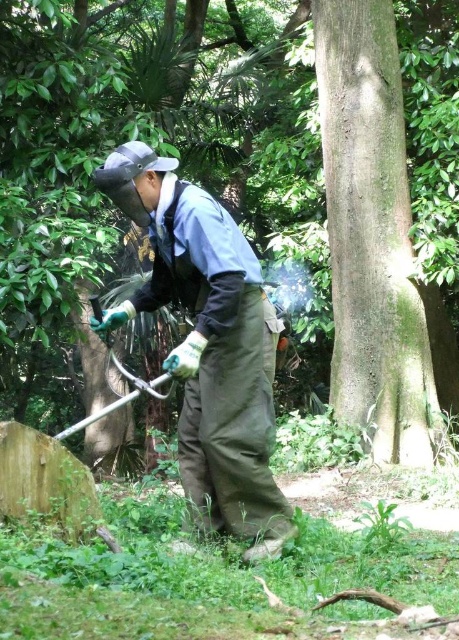
You are standing at the center of the image and want to reach the point marked at coordinate [371,236]. Which direction should you move to get there?

The point marked at coordinate [371,236] is on the smooth brown tree trunk at right, so you should move to the right to reach it.

You are standing in the forested area and want to move from point (392, 136) to point (236, 378). Which direction should you move to get closer to the camera?

To move closer to the camera, you should move from point (392, 136) to point (236, 378) because point (392, 136) is further away from the camera compared to point (236, 378).

You are navigating through a forest and need to reach a destination located at point (408, 465). You are currently at point (83, 134). Which direction should you move to get closer to your destination?

Since point (83, 134) is closer to the viewer than point (408, 465), you should move away from the viewer to reach your destination.